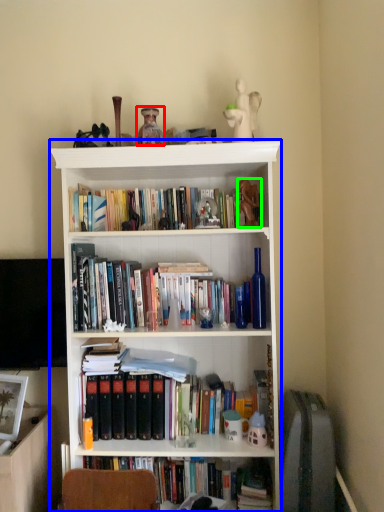
Question: Which is nearer to the toy (highlighted by a red box)? bookcase (highlighted by a blue box) or toy (highlighted by a green box).

Choices:
 (A) bookcase
 (B) toy

Answer: (B)